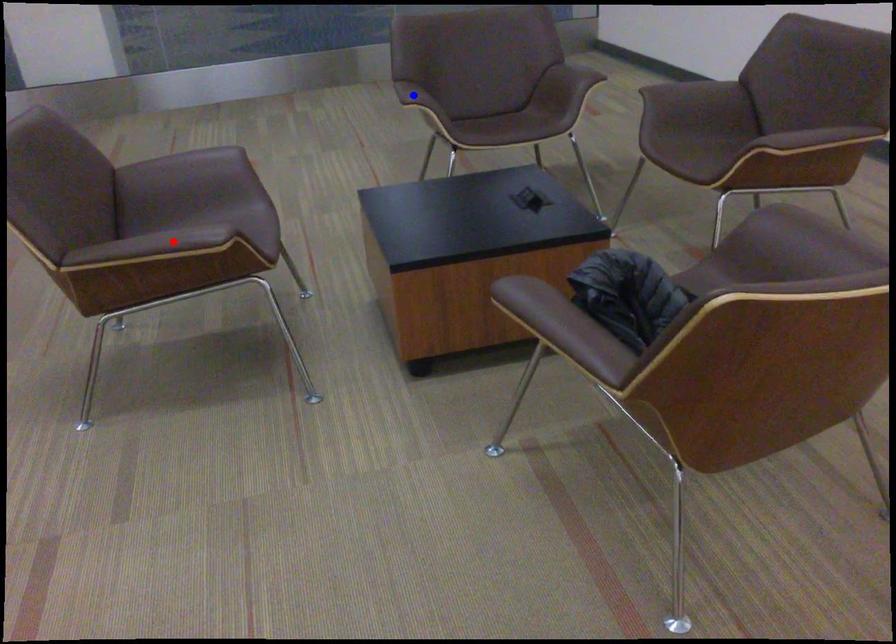
Question: Two points are marked on the image. Which point is closer to the camera?

Choices:
 (A) Blue point is closer.
 (B) Red point is closer.

Answer: (B)